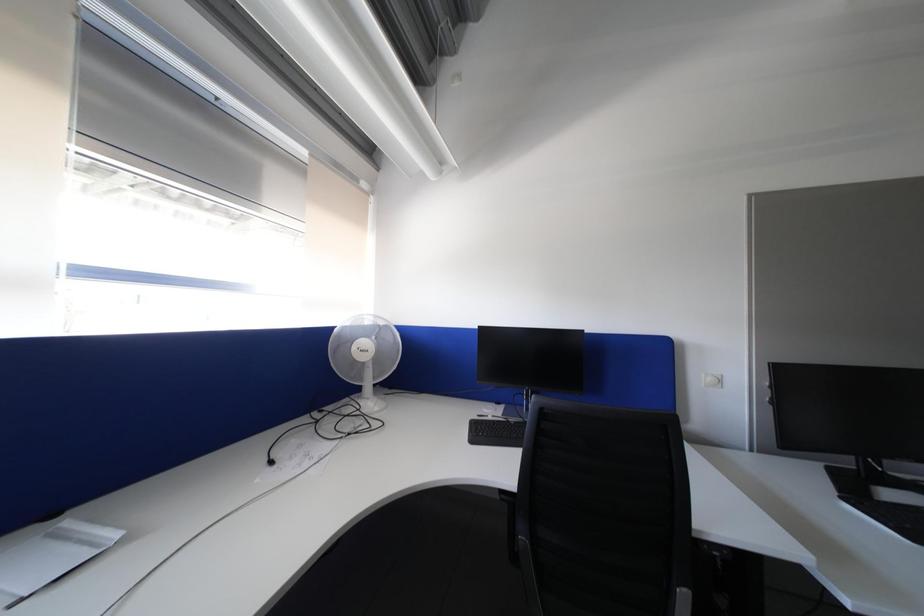
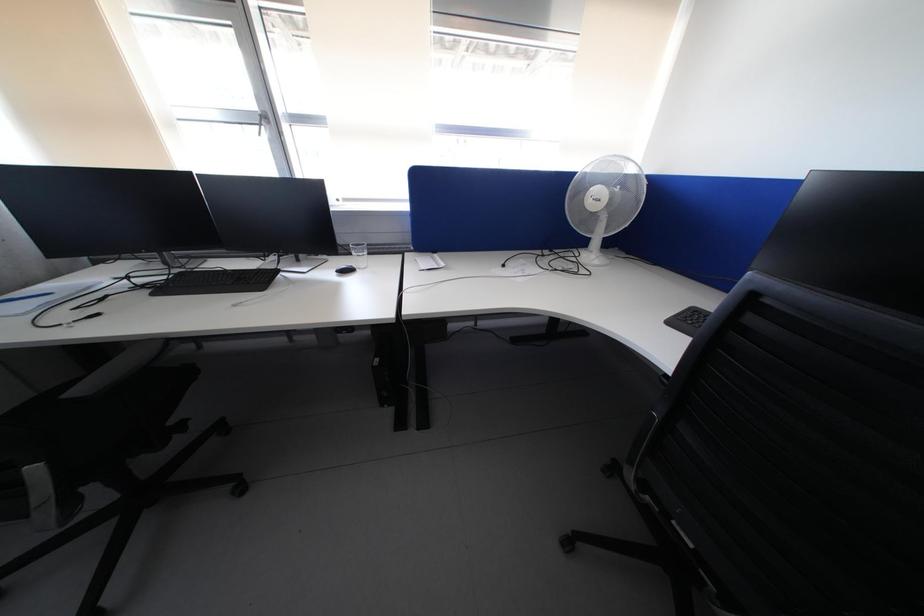
How did the camera likely rotate?

The rotation direction of the camera is left-down.